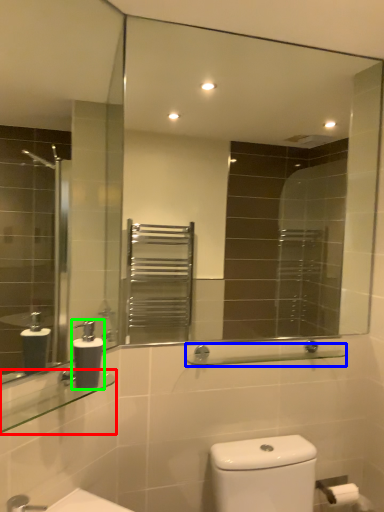
Question: Considering the real-world distances, which object is farthest from balustrade (highlighted by a red box)? balustrade (highlighted by a blue box) or soap dispenser (highlighted by a green box)?

Choices:
 (A) balustrade
 (B) soap dispenser

Answer: (A)